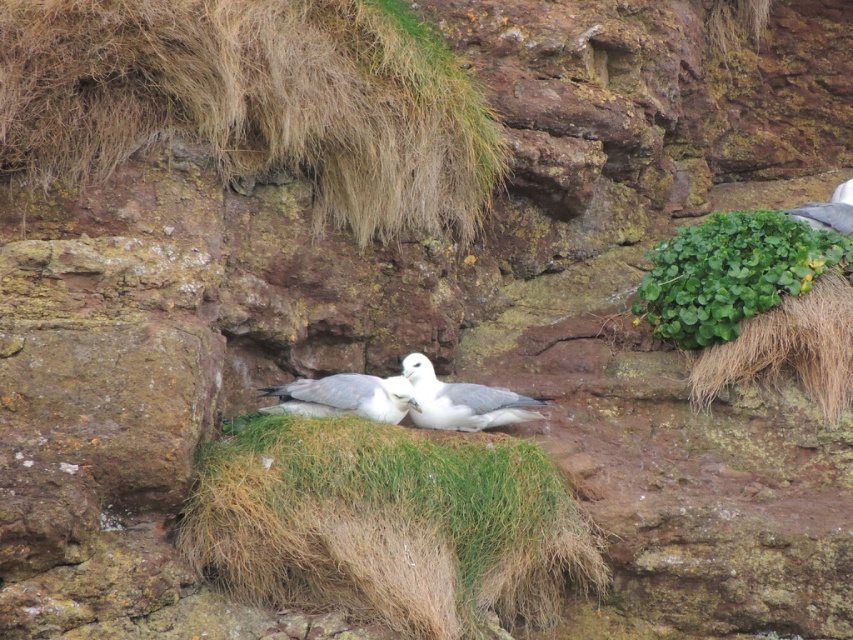
Question: Which object appears farthest from the camera in this image?

Choices:
 (A) gray feathered bird at upper right
 (B) green leafy plant at upper right
 (C) dry grass at center
 (D) brown grassy hillside at upper left

Answer: (A)

Question: Which point is closer to the camera?

Choices:
 (A) (288, 401)
 (B) (846, 262)
 (C) (445, 400)
 (D) (827, 218)

Answer: (A)

Question: Does dry grass at center appear under green leafy plant at upper right?

Choices:
 (A) yes
 (B) no

Answer: (A)

Question: Which point is closer to the camera?

Choices:
 (A) brown grassy hillside at upper left
 (B) white feathered bird at center
 (C) gray feathered bird at upper right
 (D) green leafy plant at upper right

Answer: (A)

Question: Considering the relative positions of brown grassy hillside at upper left and white feathered bird at center in the image provided, where is brown grassy hillside at upper left located with respect to white feathered bird at center?

Choices:
 (A) above
 (B) below

Answer: (A)

Question: Is green leafy plant at upper right to the left of gray feathered bird at upper right from the viewer's perspective?

Choices:
 (A) no
 (B) yes

Answer: (B)